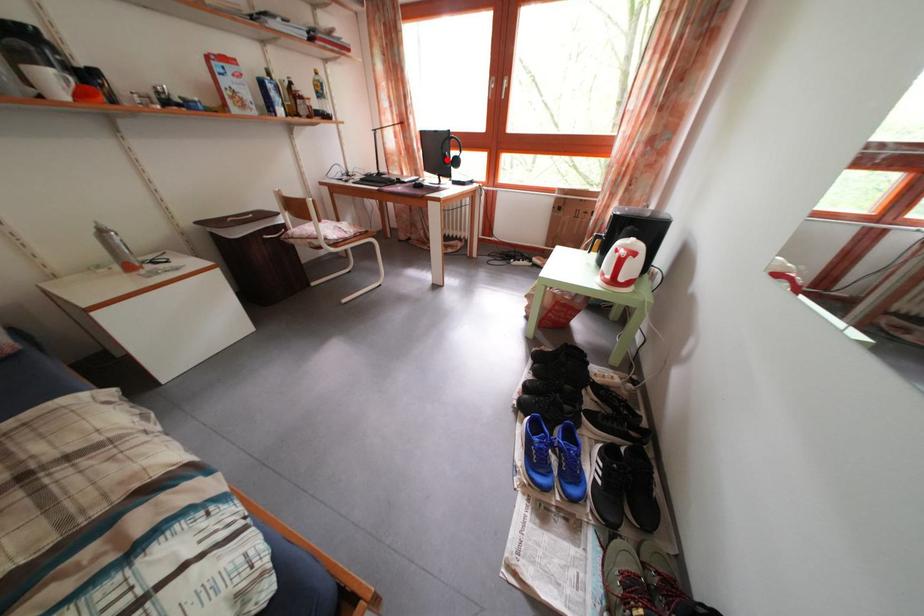
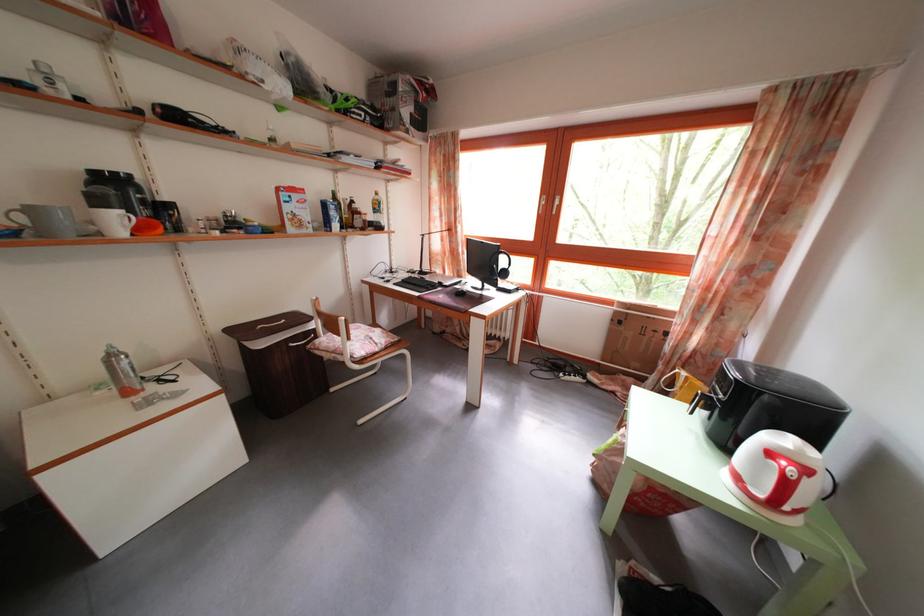
Locate, in the second image, the point that corresponds to the highlighted location in the first image.

(492, 265)